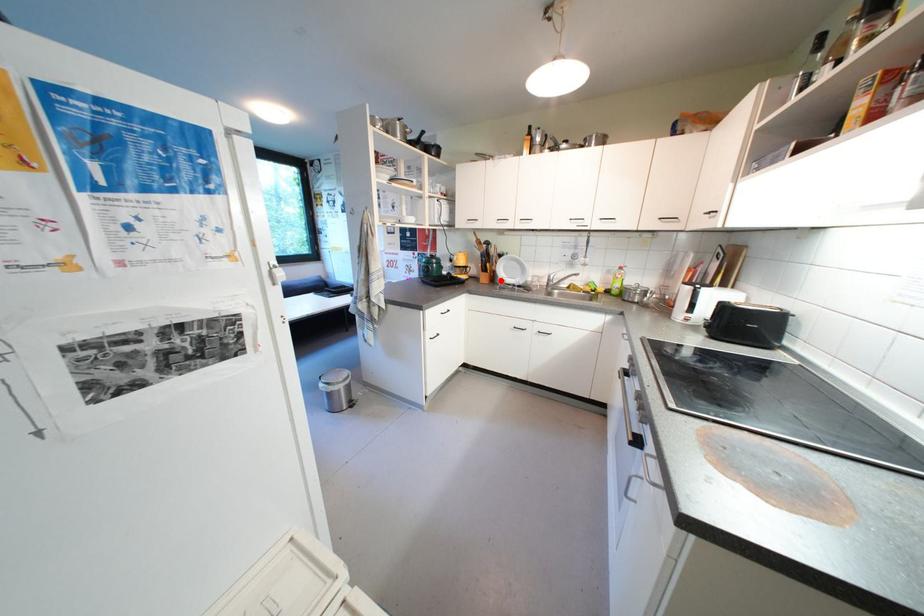
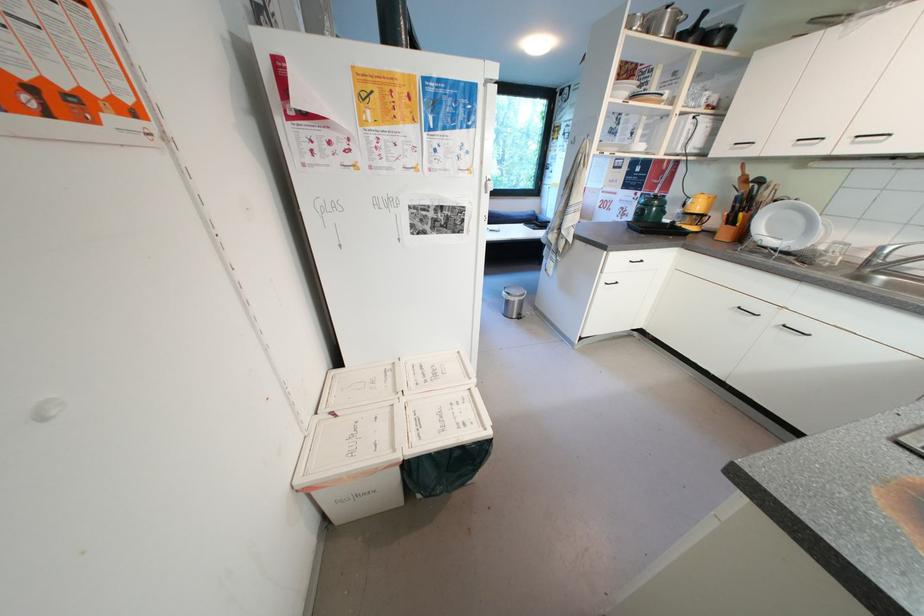
Find the pixel in the second image that matches the highlighted location in the first image.

(749, 238)